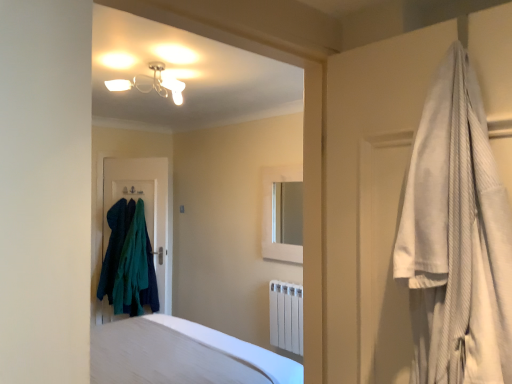
At what (x,y) coordinates should I click in order to perform the action: click on vacant area on top of white smooth bed at lower center (from a real-world perspective). Please return your answer as a coordinate pair (x, y). Image resolution: width=512 pixels, height=384 pixels. Looking at the image, I should click on (168, 349).